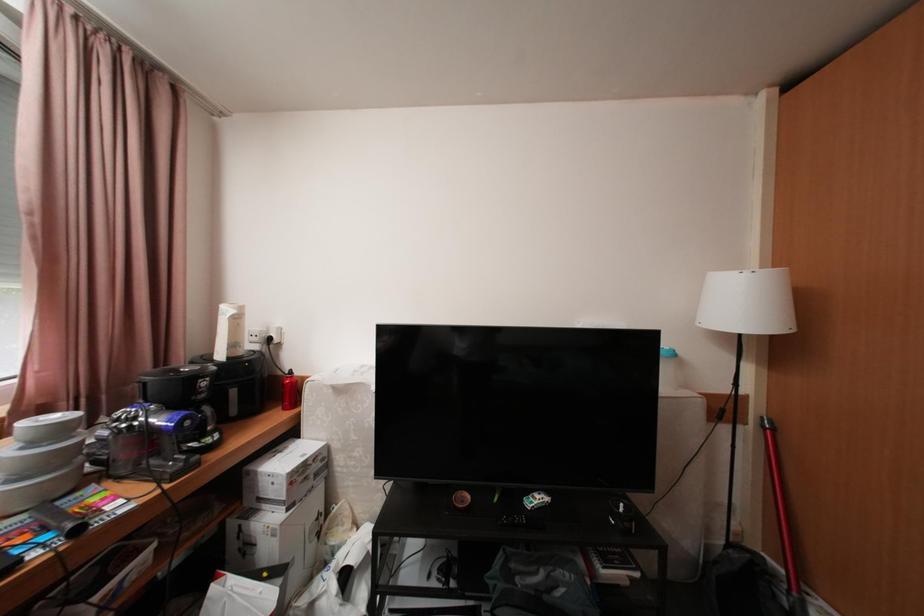
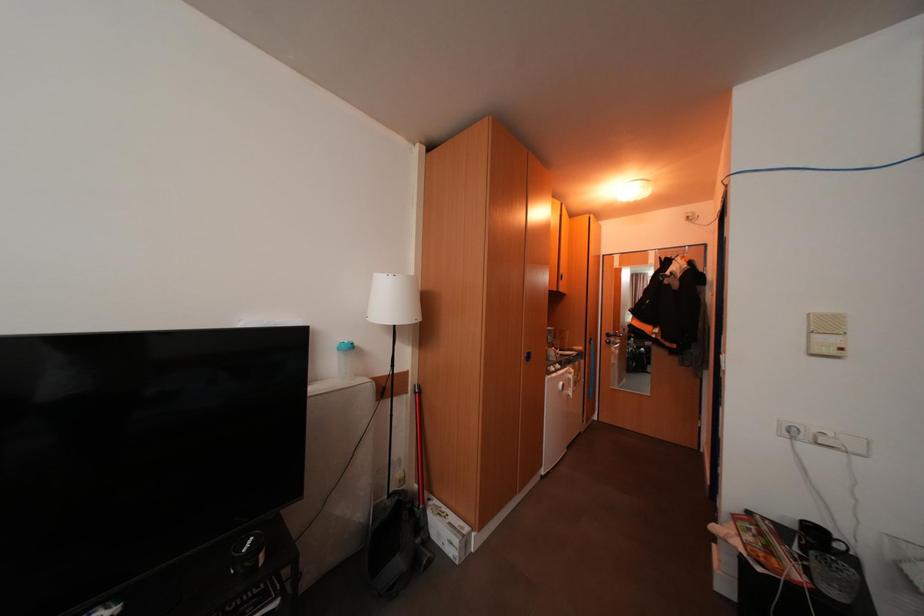
Question: The images are taken continuously from a first-person perspective. In which direction is your viewpoint rotating?

Choices:
 (A) Left
 (B) Right
 (C) Up
 (D) Down

Answer: (B)